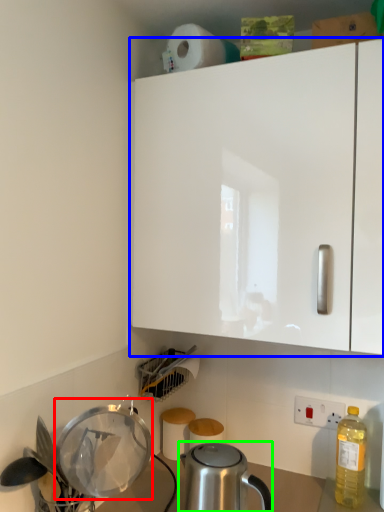
Question: Based on their relative distances, which object is nearer to appliance (highlighted by a red box)? Choose from cabinetry (highlighted by a blue box) and kettle (highlighted by a green box).

Choices:
 (A) cabinetry
 (B) kettle

Answer: (B)